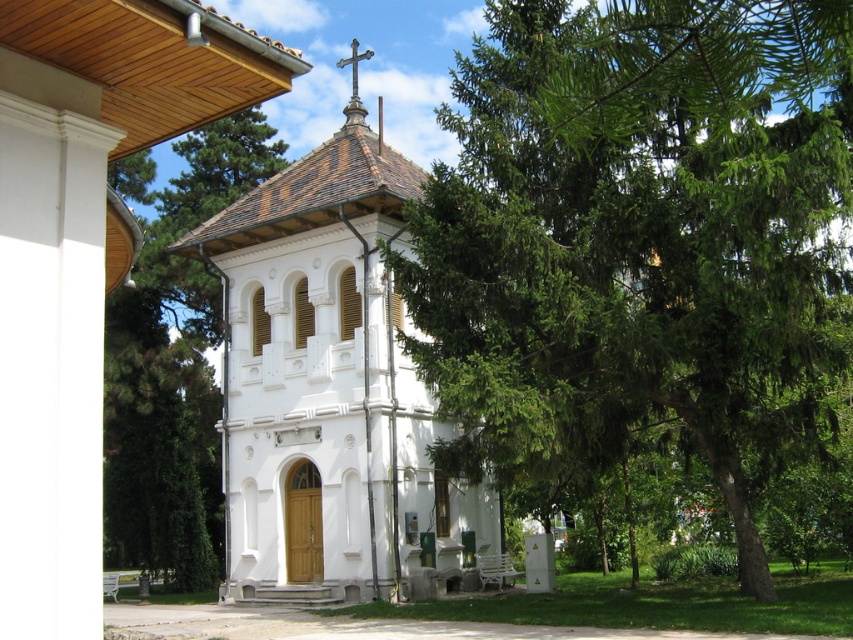
Who is positioned more to the left, green leafy tree at center or white painted wood chapel at center?

white painted wood chapel at center

Is point (793, 65) farther from viewer compared to point (254, 353)?

No, (793, 65) is in front of (254, 353).

Between point (489, 189) and point (355, 412), which one is positioned behind?

Positioned behind is point (355, 412).

I want to click on green leafy tree at center, so click(640, 241).